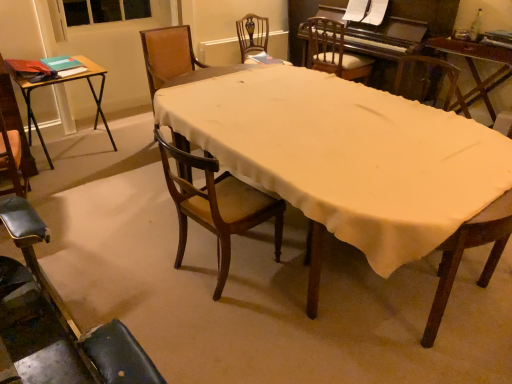
You are a GUI agent. You are given a task and a screenshot of the screen. Output one action in this format:
    pyautogui.click(x=<x>, y=<y>)
    Task: Click on the free point in front of wooden folding table at left, which is the second table from right to left
    The width and height of the screenshot is (512, 384).
    Given the screenshot: What is the action you would take?
    pyautogui.click(x=74, y=185)